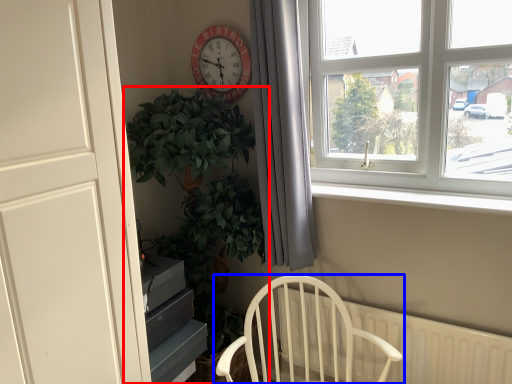
Question: Which of the following is the farthest to the observer, houseplant (highlighted by a red box) or chair (highlighted by a blue box)?

Choices:
 (A) houseplant
 (B) chair

Answer: (A)